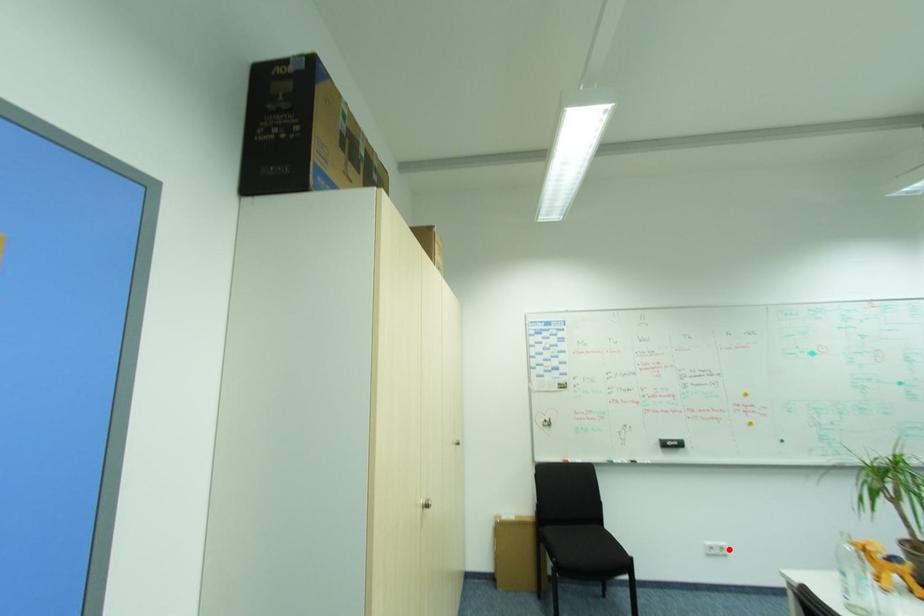
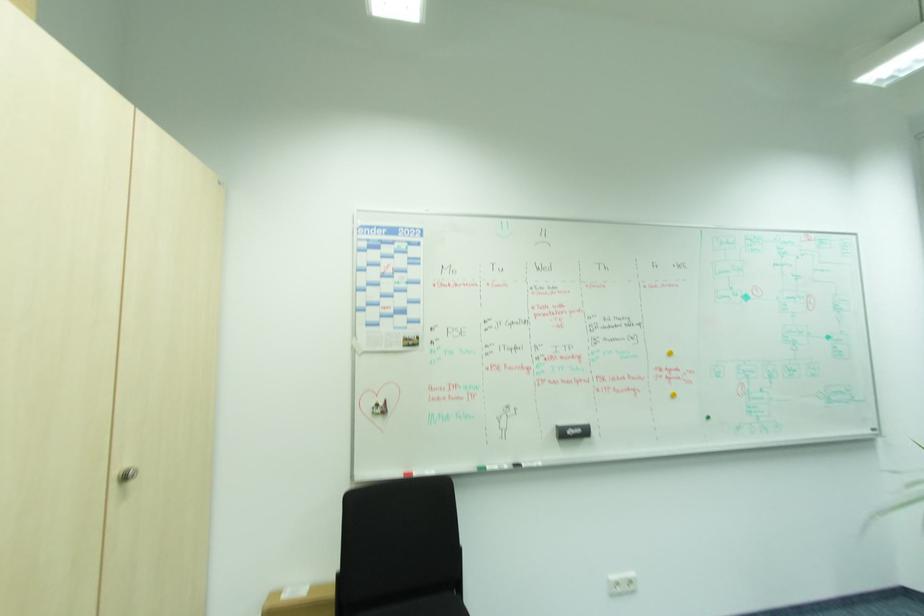
Question: I am providing you with two images of the same scene from different viewpoints. In image1, a red point is highlighted. Considering the same 3D point in image2, which of the following is correct?

Choices:
 (A) It is closer
 (B) It is farther

Answer: (B)